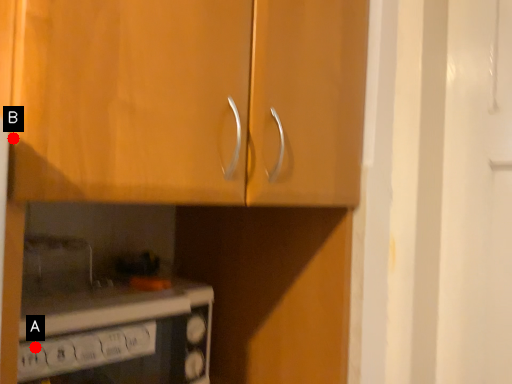
Question: Two points are circled on the image, labeled by A and B beside each circle. Which point appears closest to the camera in this image?

Choices:
 (A) A is closer
 (B) B is closer

Answer: (B)